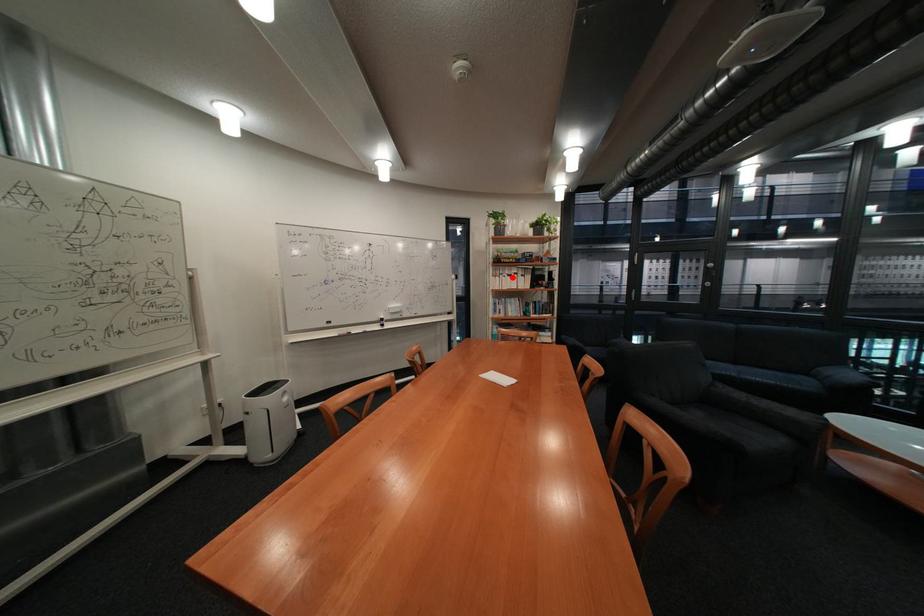
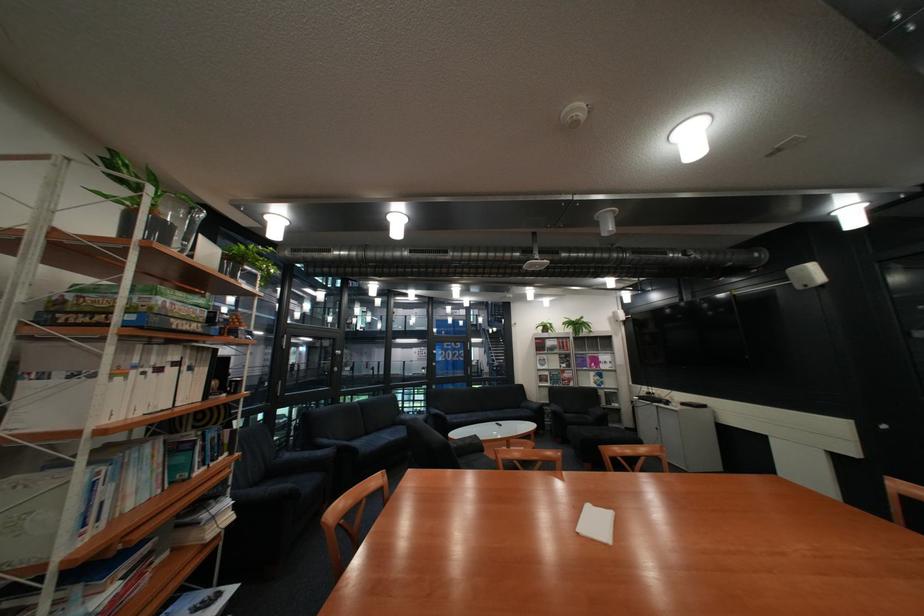
Find the pixel in the second image that matches the highlighted location in the first image.

(134, 379)